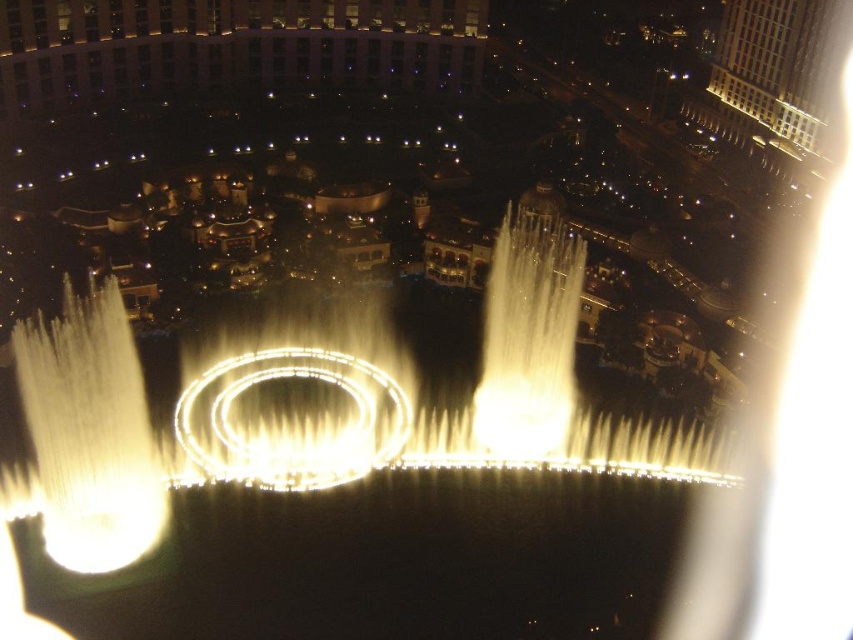
Question: Among these points, which one is farthest from the camera?

Choices:
 (A) (822, 33)
 (B) (418, 42)

Answer: (B)

Question: Where is beige stone building at upper center located in relation to white marble building at upper right in the image?

Choices:
 (A) left
 (B) right

Answer: (A)

Question: Which point appears farthest from the camera in this image?

Choices:
 (A) (144, 84)
 (B) (747, 58)

Answer: (B)

Question: Is beige stone building at upper center below white marble building at upper right?

Choices:
 (A) yes
 (B) no

Answer: (B)

Question: Observing the image, what is the correct spatial positioning of beige stone building at upper center in reference to white marble building at upper right?

Choices:
 (A) above
 (B) below

Answer: (A)

Question: Among these points, which one is farthest from the camera?

Choices:
 (A) (837, 12)
 (B) (195, 6)

Answer: (B)